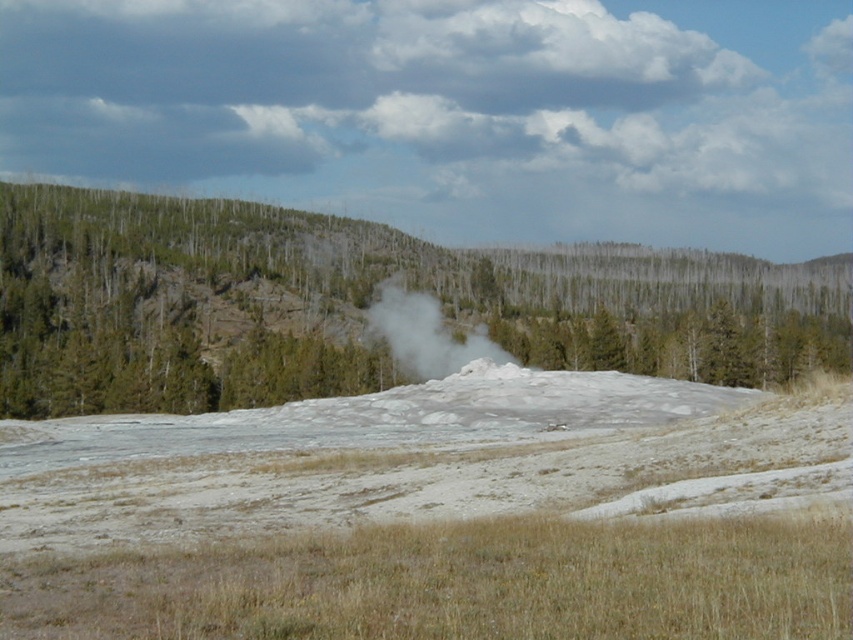
Between green textured tree at center and white steam at center, which one has less height?

Standing shorter between the two is white steam at center.

Based on the photo, does green textured tree at center appear under white steam at center?

No.

This screenshot has width=853, height=640. Find the location of `green textured tree at center`. green textured tree at center is located at coordinates click(358, 305).